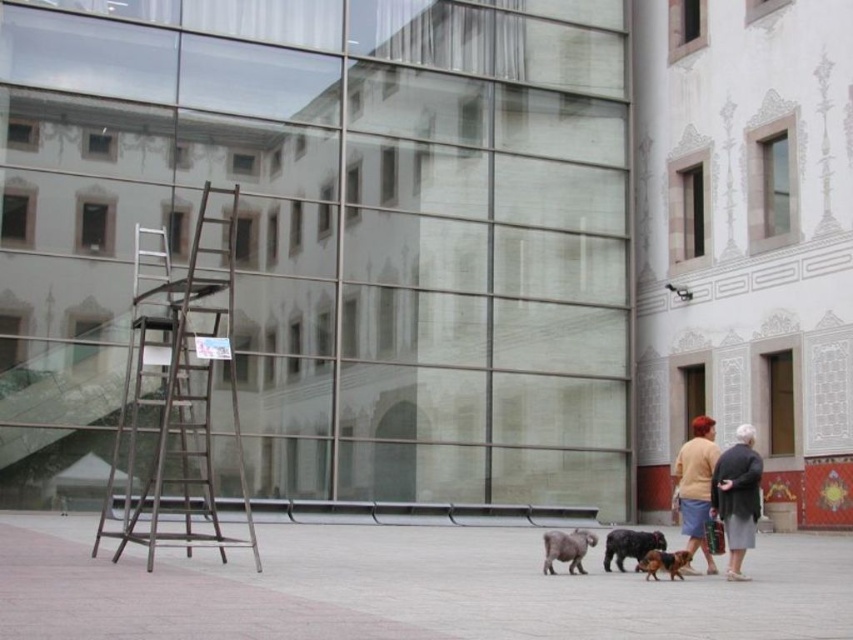
You are a delivery person standing at the entrance of the glass building. You need to place a package on the ground between the matte yellow sweater at center and the shiny black dog at center. Can you fit the package there if it measures 5 feet in length?

The distance between the matte yellow sweater at center and the shiny black dog at center is 5.15 feet. Since the package is 5 feet long, it can fit in the space between them as the available space is slightly larger than the package.

You are standing in the urban scene depicted. You need to locate the matte yellow sweater at center. According to the coordinates provided, where should you look to find it?

The matte yellow sweater at center is located at point coordinates of (695,484). This means it is positioned approximately 76 percent from the left edge and 82 percent from the bottom edge of the image.